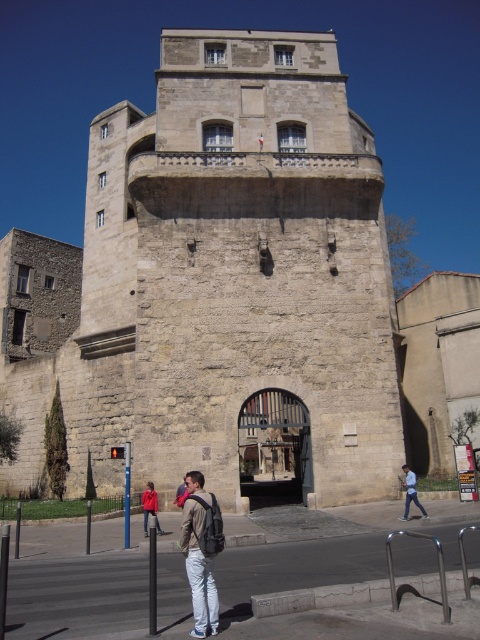
You are a tourist visiting the historic stone tower and notice a light brown backpack at center and light blue jeans at lower right. Which object is taller?

The light brown backpack at center is taller than the light blue jeans at lower right.

You are a hiker who has just arrived at the historic stone tower. You want to take a photo of the stone tower at center while keeping your light brown backpack at center visible in the frame. Since both are at the center, how can you adjust your position to ensure both are visible?

Since the stone tower at center is larger than the light brown backpack at center, you can step back to widen your field of view, allowing both the stone tower at center and the light brown backpack at center to fit into the frame.